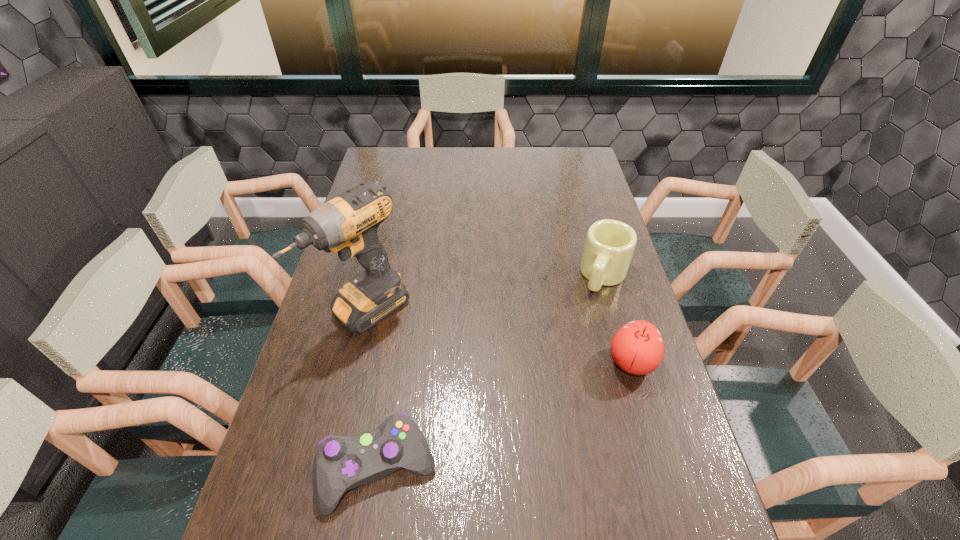
This screenshot has width=960, height=540. In the image, there is a desktop. Find the location of `vacant region at the left edge`. vacant region at the left edge is located at coordinates (324, 305).

I want to click on blank space at the right edge, so click(662, 397).

The image size is (960, 540). Identify the location of vacant region at the far left corner of the desktop. (403, 147).

This screenshot has height=540, width=960. I want to click on free point at the near left corner, so click(x=259, y=526).

Find the location of a particular element. This screenshot has height=540, width=960. free space between the mug and the drill is located at coordinates (485, 293).

Image resolution: width=960 pixels, height=540 pixels. What are the coordinates of `free space between the apple and the drill` in the screenshot? It's located at (498, 336).

Locate an element on the screen. This screenshot has width=960, height=540. free spot between the mug and the apple is located at coordinates (618, 319).

Identify the location of unoccupied position between the apple and the drill. This screenshot has height=540, width=960. (498, 336).

Where is `unoccupied area between the mug and the nearest object`? This screenshot has width=960, height=540. unoccupied area between the mug and the nearest object is located at coordinates [492, 372].

At what (x,y) coordinates should I click in order to perform the action: click on empty space that is in between the drill and the control. Please return your answer as a coordinate pair (x, y). This screenshot has height=540, width=960. Looking at the image, I should click on (372, 390).